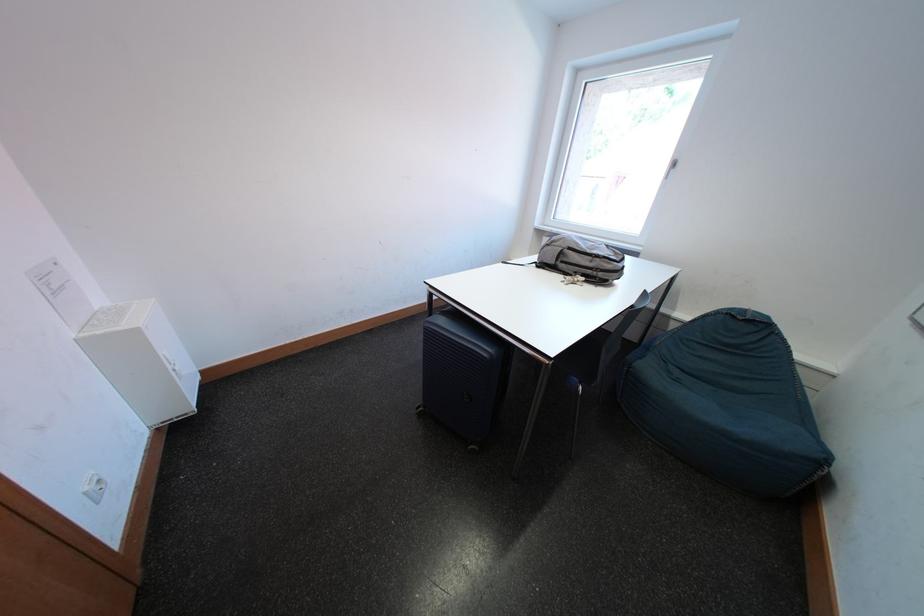
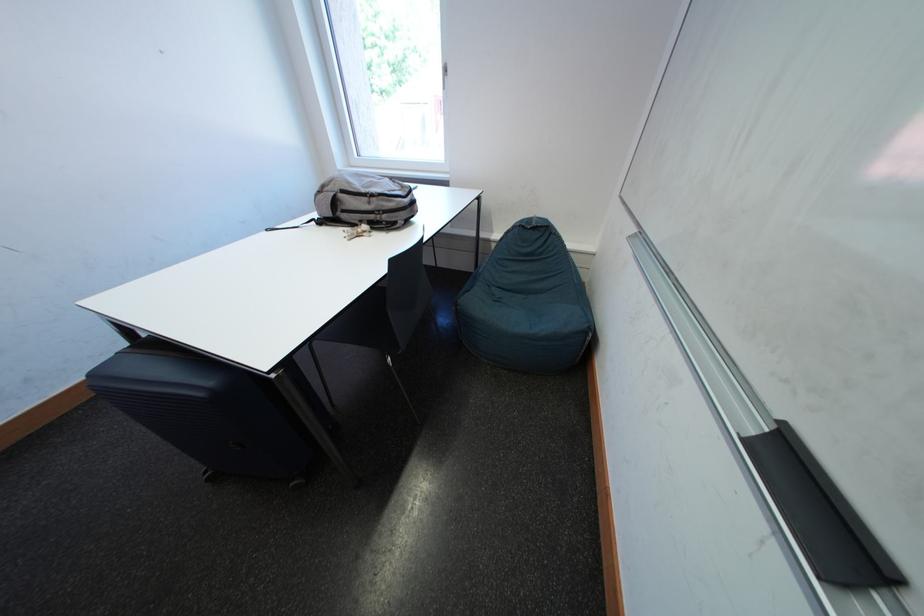
Question: The camera is either moving clockwise (left) or counter-clockwise (right) around the object. The first image is from the beginning of the video and the second image is from the end. Is the camera moving left or right when shooting the video?

Choices:
 (A) Left
 (B) Right

Answer: (A)